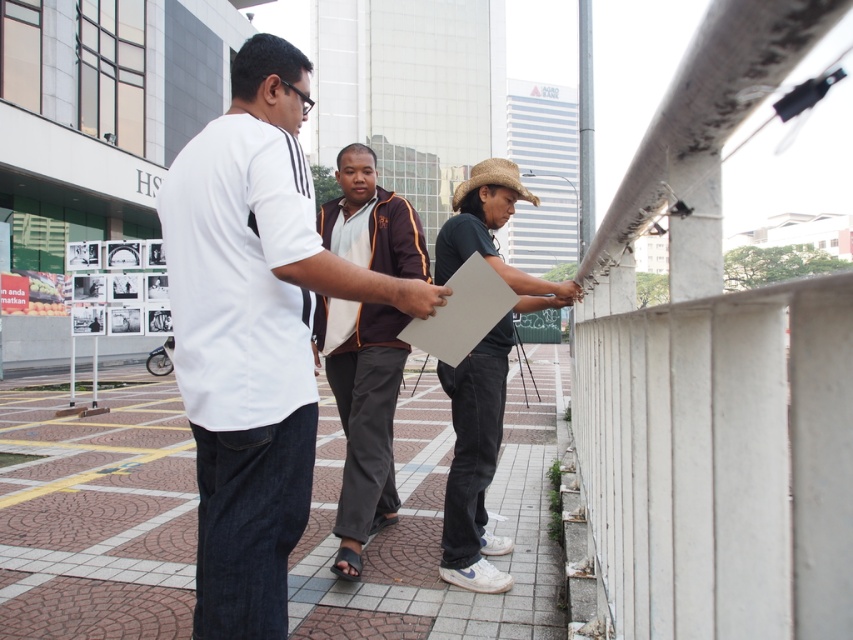
Does brick paved at center have a greater height compared to brown fabric jacket at center?

In fact, brick paved at center may be shorter than brown fabric jacket at center.

Find the location of a particular element. Image resolution: width=853 pixels, height=640 pixels. brick paved at center is located at coordinates (97, 516).

Consider the image. Who is more distant from viewer, (314, 273) or (355, 538)?

Positioned behind is point (355, 538).

Does point (270, 189) lie in front of point (343, 572)?

Yes, point (270, 189) is closer to viewer.

This screenshot has width=853, height=640. Find the location of `white matte shirt at center`. white matte shirt at center is located at coordinates (253, 333).

Can you confirm if brown fabric jacket at center is smaller than dark green matte shirt at center?

No.

Between brown fabric jacket at center and dark green matte shirt at center, which one appears on the right side from the viewer's perspective?

dark green matte shirt at center is more to the right.

Is point (384, 500) farther from viewer compared to point (456, 268)?

That is True.

Locate an element on the screen. brown fabric jacket at center is located at coordinates (363, 413).